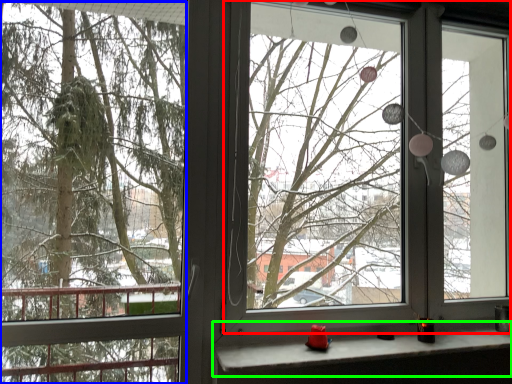
Question: Based on their relative distances, which object is nearer to window screen (highlighted by a red box)? Choose from tree (highlighted by a blue box) and window sill (highlighted by a green box).

Choices:
 (A) tree
 (B) window sill

Answer: (A)